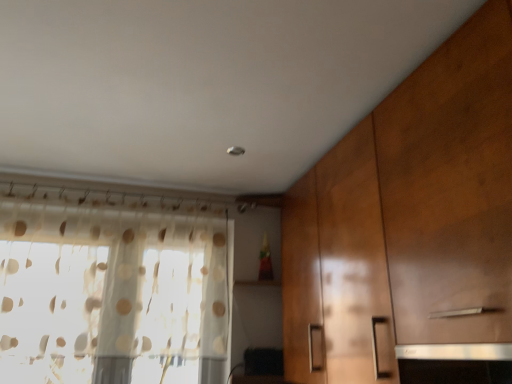
Question: Is translucent fabric curtain at left in front of or behind wooden cabinet at right in the image?

Choices:
 (A) front
 (B) behind

Answer: (B)

Question: Considering the positions of translucent fabric curtain at left and wooden cabinet at right in the image, is translucent fabric curtain at left taller or shorter than wooden cabinet at right?

Choices:
 (A) short
 (B) tall

Answer: (A)

Question: Based on their positions, is translucent fabric curtain at left located to the left or right of wooden cabinet at right?

Choices:
 (A) left
 (B) right

Answer: (A)

Question: Considering their positions, is wooden cabinet at right located in front of or behind translucent fabric curtain at left?

Choices:
 (A) front
 (B) behind

Answer: (A)

Question: From a real-world perspective, is wooden cabinet at right positioned above or below translucent fabric curtain at left?

Choices:
 (A) above
 (B) below

Answer: (B)

Question: Is point (500, 271) positioned closer to the camera than point (176, 324)?

Choices:
 (A) farther
 (B) closer

Answer: (B)

Question: Based on their sizes in the image, would you say wooden cabinet at right is bigger or smaller than translucent fabric curtain at left?

Choices:
 (A) big
 (B) small

Answer: (A)